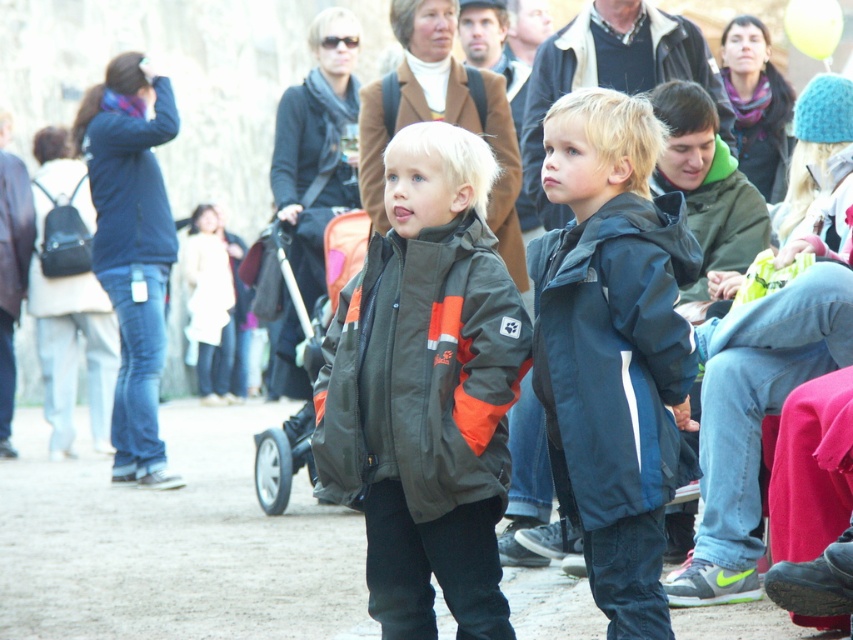
You are a photographer trying to capture a photo of the dark blue waterproof jacket at center and the orange fabric baby carriage at center. Which object should you adjust your camera focus to first if you want to take a picture of both in the same frame?

The orange fabric baby carriage at center should be focused on first since it is positioned to the left of the dark blue waterproof jacket at center, allowing you to adjust your camera to include both in the frame by panning slightly to the right.